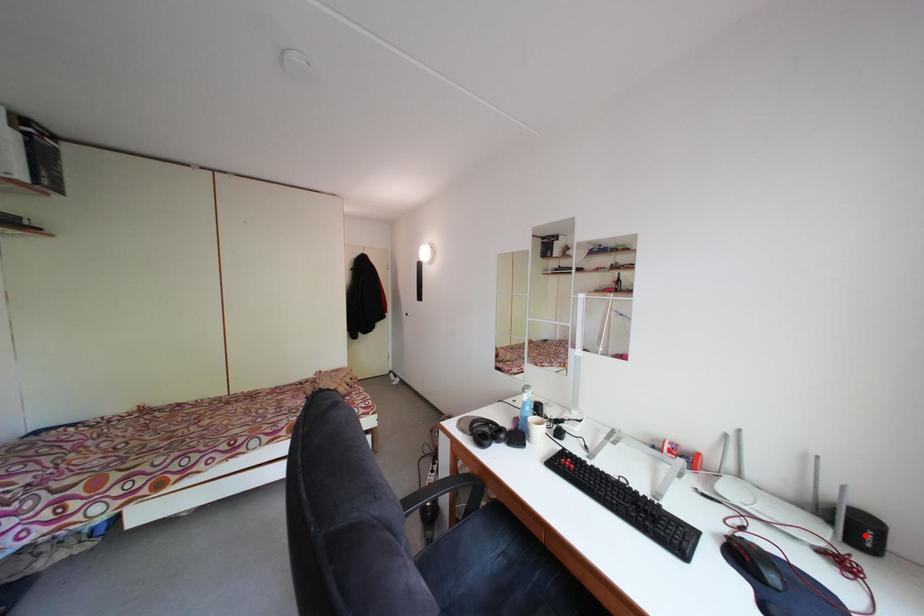
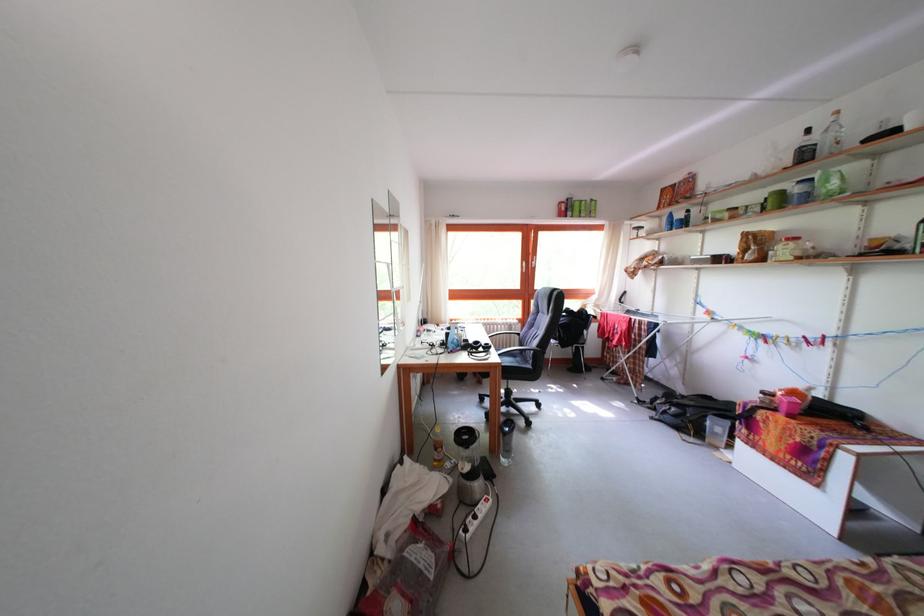
Question: I am providing you with two images of the same scene from different viewpoints. A red point is marked on the first image. At the location where the point appears in image 1, is it still visible in image 2?

Choices:
 (A) Yes
 (B) No

Answer: (B)